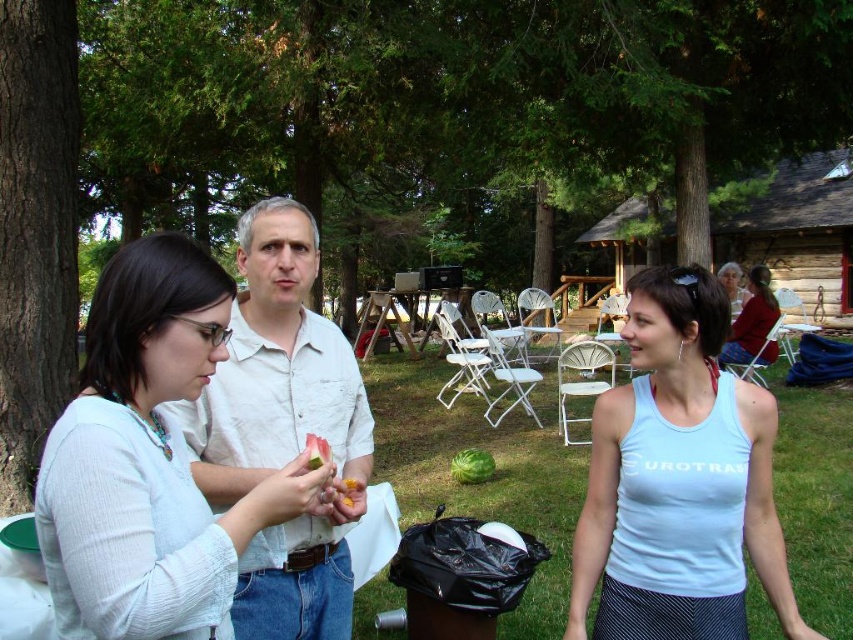
Question: Which point is farther to the camera?

Choices:
 (A) (459, 468)
 (B) (16, 74)
 (C) (194, 497)

Answer: (A)

Question: Where is matte white shirt at center located in relation to white cotton shirt at center in the image?

Choices:
 (A) right
 (B) left

Answer: (B)

Question: Considering the real-world distances, which object is closest to the matte red shirt at center?

Choices:
 (A) white cotton shirt at center
 (B) green matte flower at center

Answer: (A)

Question: Can you confirm if white tank top at center is positioned below white cotton shirt at center?

Choices:
 (A) yes
 (B) no

Answer: (A)

Question: Can you confirm if white tank top at center is positioned to the right of yellow rubbery fruit at center?

Choices:
 (A) no
 (B) yes

Answer: (B)

Question: Which of the following is the farthest from the observer?

Choices:
 (A) (339, 488)
 (B) (30, 268)

Answer: (B)